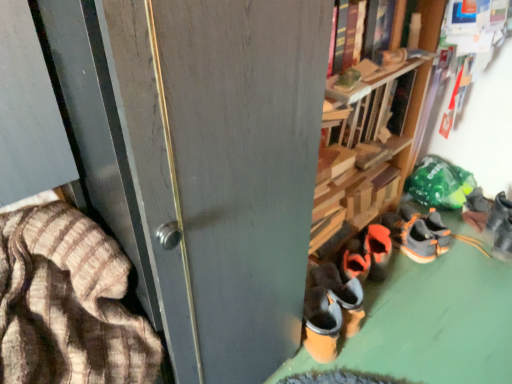
The width and height of the screenshot is (512, 384). I want to click on empty space that is ontop of orange suede shoes at center, which is counted as the third footwear, starting from the left (from a real-world perspective), so click(x=432, y=302).